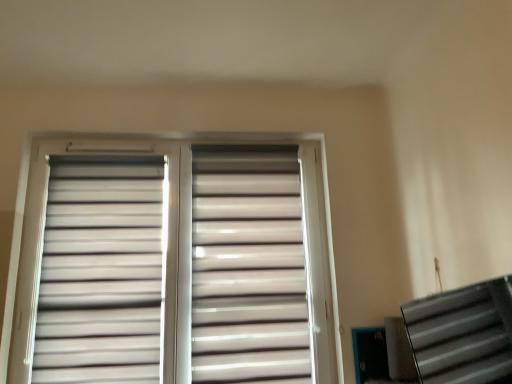
Question: Is matte white blinds at center not near matte white shutter at center, which is counted as the 2th shutter, starting from the left?

Choices:
 (A) yes
 (B) no

Answer: (B)

Question: Does matte white blinds at center have a greater height compared to matte white shutter at center, which is counted as the 2th shutter, starting from the left?

Choices:
 (A) no
 (B) yes

Answer: (B)

Question: Does matte white blinds at center appear on the right side of matte white shutter at center, which appears as the first shutter when viewed from the right?

Choices:
 (A) yes
 (B) no

Answer: (B)

Question: Does matte white blinds at center turn towards matte white shutter at center, which appears as the first shutter when viewed from the right?

Choices:
 (A) no
 (B) yes

Answer: (B)

Question: Does matte white blinds at center appear on the left side of matte white shutter at center, which is counted as the 2th shutter, starting from the left?

Choices:
 (A) yes
 (B) no

Answer: (A)

Question: Does matte white blinds at center have a smaller size compared to matte white shutter at center, which is counted as the 2th shutter, starting from the left?

Choices:
 (A) no
 (B) yes

Answer: (A)

Question: Is white matte shutter at upper left, the first shutter viewed from the left, smaller than matte white shutter at center, which appears as the first shutter when viewed from the right?

Choices:
 (A) no
 (B) yes

Answer: (B)

Question: Is white matte shutter at upper left, the first shutter viewed from the left, far from matte white shutter at center, which appears as the first shutter when viewed from the right?

Choices:
 (A) yes
 (B) no

Answer: (B)

Question: From the image's perspective, would you say white matte shutter at upper left, acting as the 2th shutter starting from the right, is positioned over matte white shutter at center, which is counted as the 2th shutter, starting from the left?

Choices:
 (A) no
 (B) yes

Answer: (B)

Question: Is white matte shutter at upper left, acting as the 2th shutter starting from the right, at the right side of matte white shutter at center, which appears as the first shutter when viewed from the right?

Choices:
 (A) no
 (B) yes

Answer: (A)

Question: Does white matte shutter at upper left, acting as the 2th shutter starting from the right, turn towards matte white shutter at center, which is counted as the 2th shutter, starting from the left?

Choices:
 (A) yes
 (B) no

Answer: (B)

Question: Considering the relative positions of white matte shutter at upper left, the first shutter viewed from the left, and matte white shutter at center, which is counted as the 2th shutter, starting from the left, in the image provided, is white matte shutter at upper left, the first shutter viewed from the left, behind matte white shutter at center, which is counted as the 2th shutter, starting from the left,?

Choices:
 (A) yes
 (B) no

Answer: (B)

Question: Considering the relative sizes of metallic silver stairwell at lower right and matte white shutter at center, which appears as the first shutter when viewed from the right, in the image provided, is metallic silver stairwell at lower right wider than matte white shutter at center, which appears as the first shutter when viewed from the right,?

Choices:
 (A) yes
 (B) no

Answer: (A)